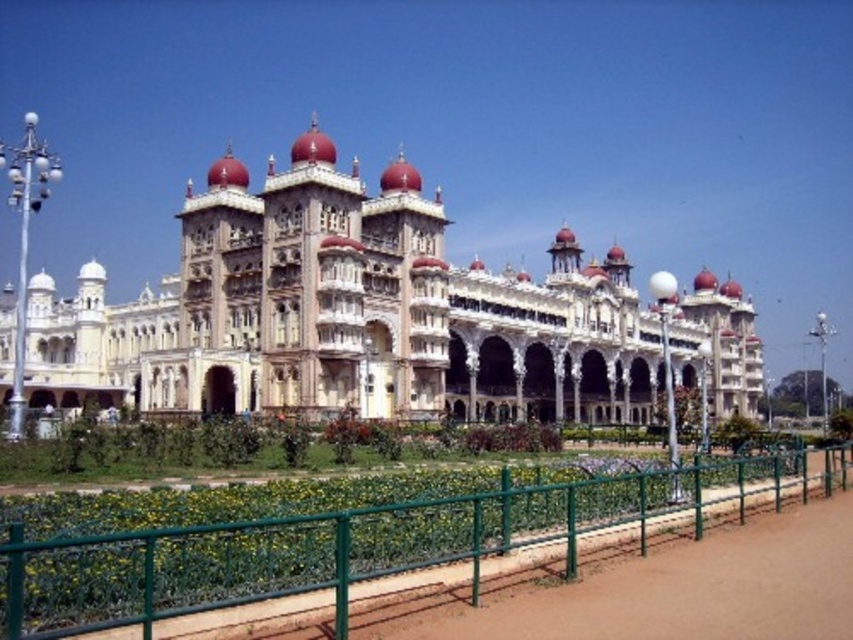
Question: Which point is farther to the camera?

Choices:
 (A) white stone palace at center
 (B) green metal fence at lower center

Answer: (A)

Question: Can you confirm if white stone palace at center is smaller than green metal fence at lower center?

Choices:
 (A) no
 (B) yes

Answer: (A)

Question: Is white stone palace at center to the right of green metal fence at lower center from the viewer's perspective?

Choices:
 (A) no
 (B) yes

Answer: (A)

Question: Does white stone palace at center come in front of green metal fence at lower center?

Choices:
 (A) no
 (B) yes

Answer: (A)

Question: Among these points, which one is farthest from the camera?

Choices:
 (A) (592, 384)
 (B) (204, 588)

Answer: (A)